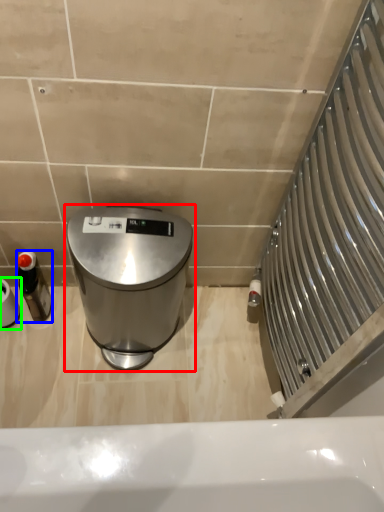
Question: Estimate the real-world distances between objects in this image. Which object is closer to waste container (highlighted by a red box), bottle (highlighted by a blue box) or toilet paper (highlighted by a green box)?

Choices:
 (A) bottle
 (B) toilet paper

Answer: (A)